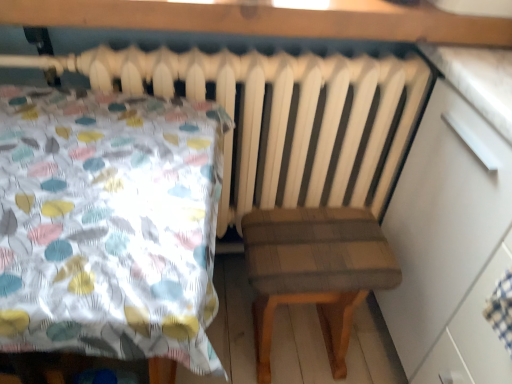
At what (x,y) coordinates should I click in order to perform the action: click on vacant area on top of plaid fabric stool at center (from a real-world perspective). Please return your answer as a coordinate pair (x, y). Image resolution: width=512 pixels, height=384 pixels. Looking at the image, I should click on (315, 251).